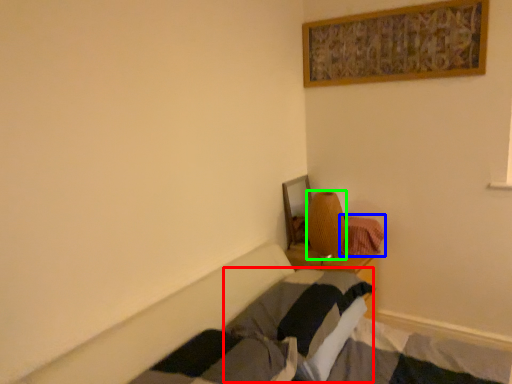
Question: Considering the real-world distances, which object is farthest from pillow (highlighted by a red box)? blanket (highlighted by a blue box) or lamp (highlighted by a green box)?

Choices:
 (A) blanket
 (B) lamp

Answer: (A)